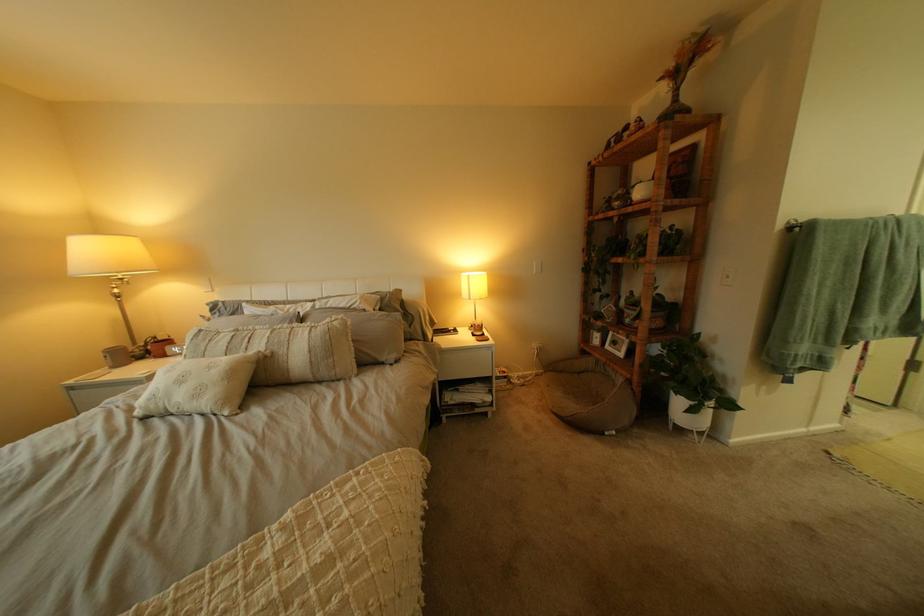
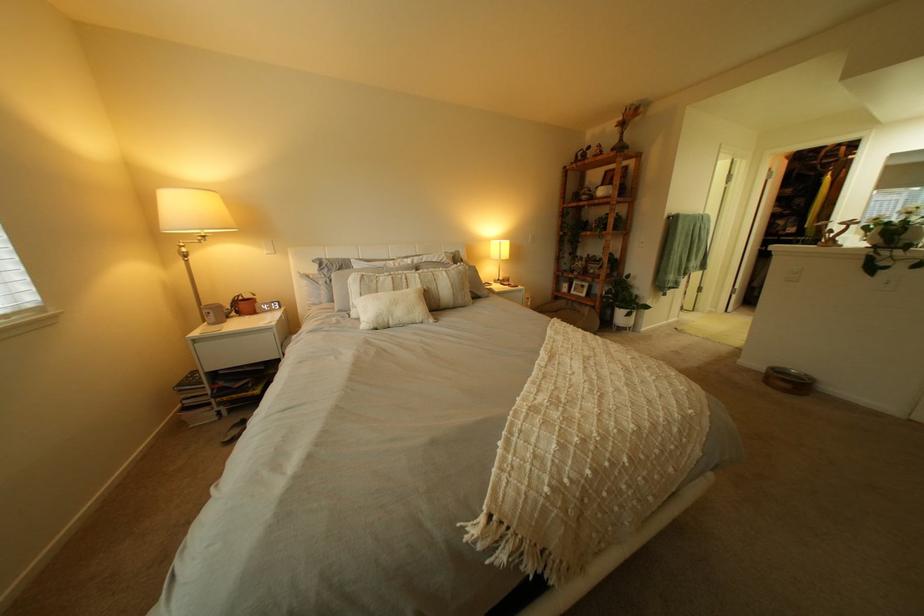
Find the pixel in the second image that matches (x=281, y=342) in the first image.

(434, 283)